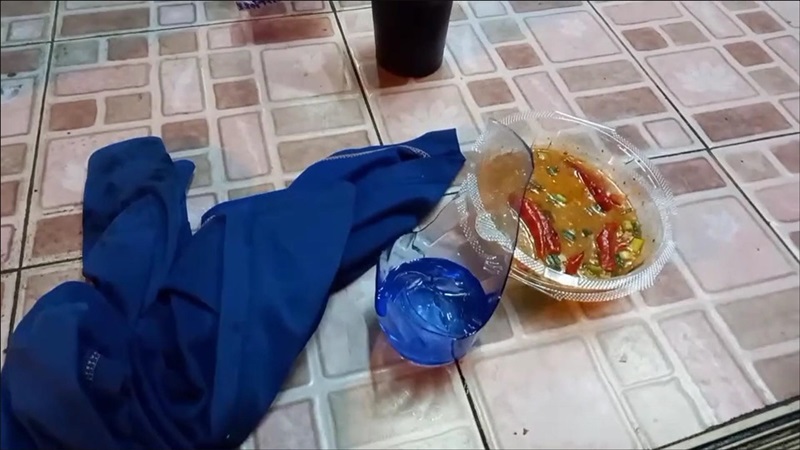
You are a GUI agent. You are given a task and a screenshot of the screen. Output one action in this format:
    pyautogui.click(x=<x>, y=<y>)
    Task: Click on the pot
    
    Given the screenshot: What is the action you would take?
    pyautogui.click(x=418, y=57)